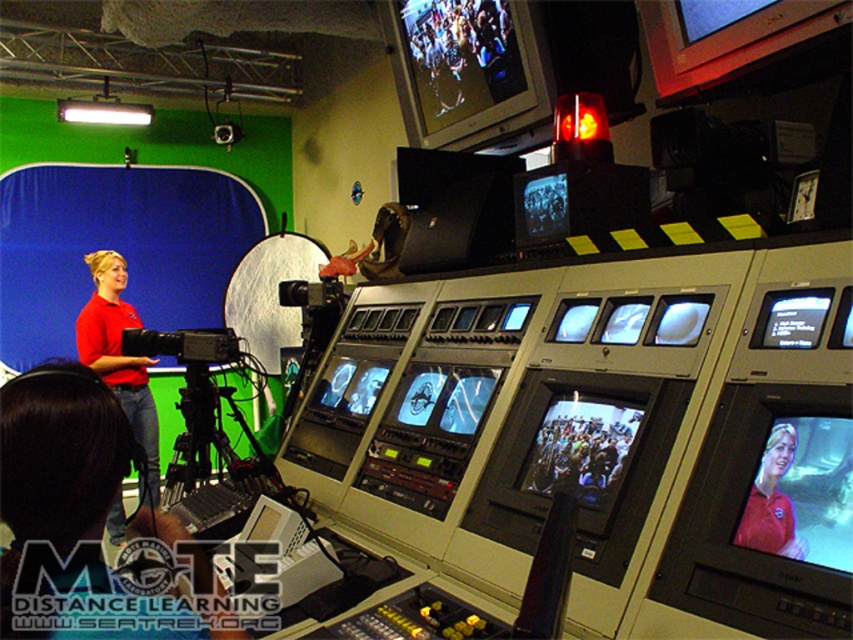
Question: Which of the following is the closest to the observer?

Choices:
 (A) matte black monitor at center right
 (B) matte black video camera at left

Answer: (A)

Question: Which is farther from the matte black video camera at left?

Choices:
 (A) matte black monitor at center right
 (B) matte red shirt at left

Answer: (A)

Question: Is matte red shirt at left wider than red shirt at left?

Choices:
 (A) no
 (B) yes

Answer: (A)

Question: Can you confirm if matte black video camera at left is positioned below matte black monitor at center right?

Choices:
 (A) no
 (B) yes

Answer: (B)

Question: Which of the following is the closest to the observer?

Choices:
 (A) click(152, 497)
 (B) click(747, 529)

Answer: (B)

Question: Is matte black video camera at left further to the viewer compared to matte red shirt at center?

Choices:
 (A) yes
 (B) no

Answer: (A)